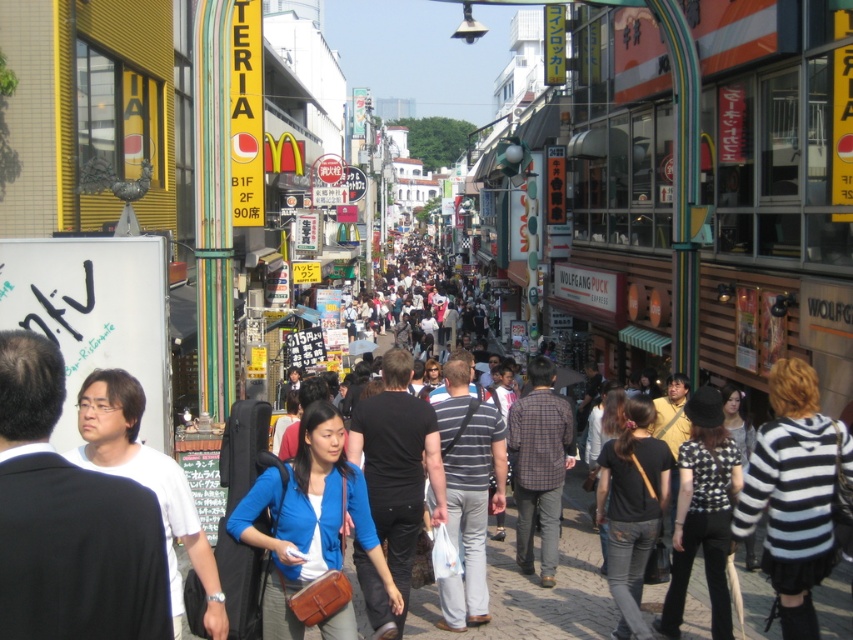
You are standing on the bustling urban street scene in Japan. You see two points marked in the image. The first point is at coordinate (x=778, y=483) and the second is at (x=448, y=628). Which point is closer to your current position?

Point (x=778, y=483) is closer to the camera than point (x=448, y=628), so the first point is closer to your current position.

You are standing at the camera position in the bustling urban street scene. There is a specific point marked at coordinates point (653, 502). Can you estimate how far this point is from your current position?

The point (653, 502) is 43.36 feet away from the camera position.

You are a photographer standing at the edge of the street. You want to take a photo that includes both the black and white striped sweater at lower right and the striped cotton shirt at center. Which one will appear larger in your photo?

The black and white striped sweater at lower right will appear larger in the photo because it is closer to the viewer than the striped cotton shirt at center.